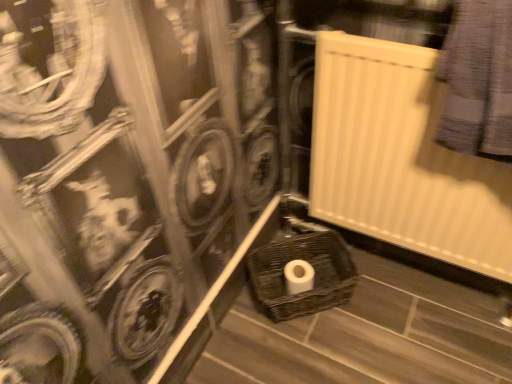
Image resolution: width=512 pixels, height=384 pixels. I want to click on white matte radiator at right, so click(401, 158).

What do you see at coordinates (401, 158) in the screenshot? The image size is (512, 384). I see `white matte radiator at right` at bounding box center [401, 158].

You are a GUI agent. You are given a task and a screenshot of the screen. Output one action in this format:
    pyautogui.click(x=<x>, y=<y>)
    Task: Click on the white matte radiator at right
    The image size is (512, 384).
    Given the screenshot: What is the action you would take?
    pyautogui.click(x=401, y=158)